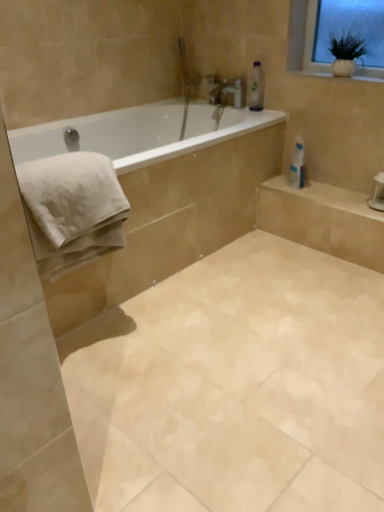
Question: Can you confirm if clear plastic bottle at upper center is taller than beige marble tile at center?

Choices:
 (A) yes
 (B) no

Answer: (A)

Question: Considering the relative sizes of clear plastic bottle at upper center and beige marble tile at center in the image provided, is clear plastic bottle at upper center smaller than beige marble tile at center?

Choices:
 (A) yes
 (B) no

Answer: (A)

Question: Is clear plastic bottle at upper center positioned behind beige marble tile at center?

Choices:
 (A) yes
 (B) no

Answer: (A)

Question: From a real-world perspective, is clear plastic bottle at upper center located beneath beige marble tile at center?

Choices:
 (A) yes
 (B) no

Answer: (B)

Question: Is clear plastic bottle at upper center bigger than beige marble tile at center?

Choices:
 (A) no
 (B) yes

Answer: (A)

Question: Can you confirm if clear plastic bottle at upper center is thinner than beige marble tile at center?

Choices:
 (A) yes
 (B) no

Answer: (A)

Question: Is white glossy toilet paper at upper right surrounded by white ceramic vase at upper right?

Choices:
 (A) yes
 (B) no

Answer: (B)

Question: Is white ceramic vase at upper right with white glossy toilet paper at upper right?

Choices:
 (A) no
 (B) yes

Answer: (A)

Question: Does white ceramic vase at upper right lie behind white glossy toilet paper at upper right?

Choices:
 (A) yes
 (B) no

Answer: (B)

Question: Considering the relative sizes of white ceramic vase at upper right and white glossy toilet paper at upper right in the image provided, is white ceramic vase at upper right shorter than white glossy toilet paper at upper right?

Choices:
 (A) yes
 (B) no

Answer: (A)

Question: Can you confirm if white ceramic vase at upper right is smaller than white glossy toilet paper at upper right?

Choices:
 (A) no
 (B) yes

Answer: (B)

Question: Considering the relative positions of white ceramic vase at upper right and white glossy toilet paper at upper right in the image provided, is white ceramic vase at upper right to the right of white glossy toilet paper at upper right from the viewer's perspective?

Choices:
 (A) no
 (B) yes

Answer: (B)

Question: From the image's perspective, does white ceramic vase at upper right appear lower than white cotton towel at left?

Choices:
 (A) yes
 (B) no

Answer: (B)